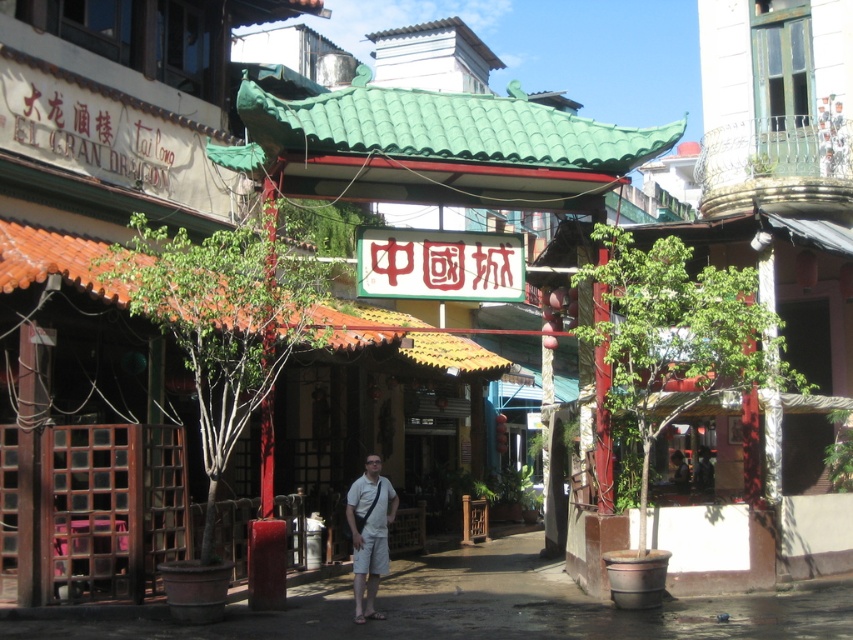
Question: Which point is closer to the camera taking this photo?

Choices:
 (A) (521, 540)
 (B) (682, 474)

Answer: (A)

Question: Which point is closer to the camera?

Choices:
 (A) dark gray fabric pants at lower center
 (B) white cotton shorts at center

Answer: (B)

Question: Which of these objects is positioned closest to the white cotton shorts at center?

Choices:
 (A) dark gray fabric pants at lower center
 (B) green tile canopy at center
 (C) smooth concrete alley at center

Answer: (C)

Question: Is green tile canopy at center below smooth concrete alley at center?

Choices:
 (A) no
 (B) yes

Answer: (A)

Question: Does green tile canopy at center appear under smooth concrete alley at center?

Choices:
 (A) no
 (B) yes

Answer: (A)

Question: From the image, what is the correct spatial relationship of green tile canopy at center in relation to dark gray fabric pants at lower center?

Choices:
 (A) above
 (B) below

Answer: (A)